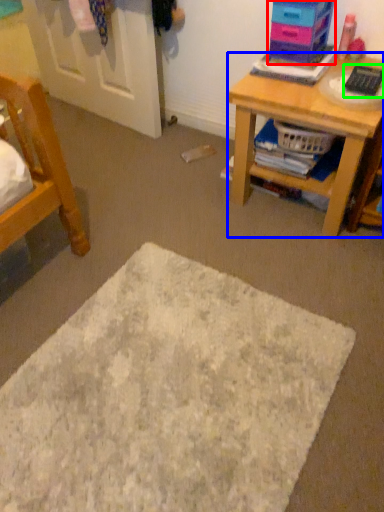
Question: Based on their relative distances, which object is farther from shelf (highlighted by a red box)? Choose from desk (highlighted by a blue box) and remote control (highlighted by a green box).

Choices:
 (A) desk
 (B) remote control

Answer: (A)